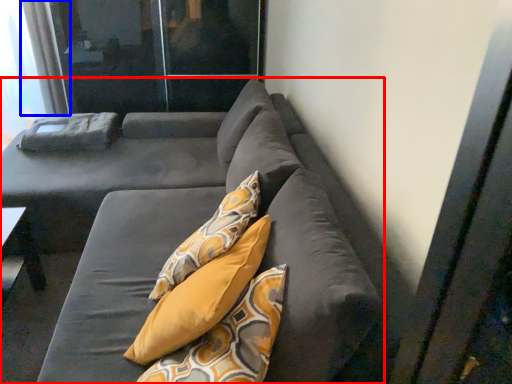
Question: Which of the following is the farthest to the observer, studio couch (highlighted by a red box) or curtain (highlighted by a blue box)?

Choices:
 (A) studio couch
 (B) curtain

Answer: (B)